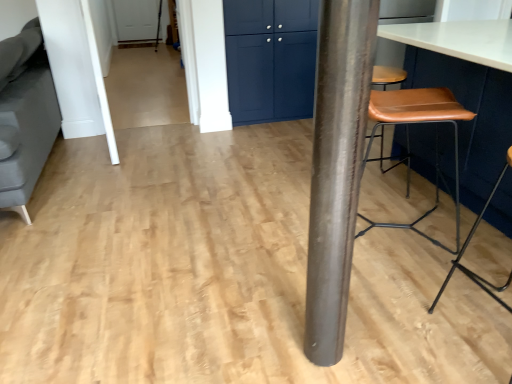
Image resolution: width=512 pixels, height=384 pixels. What do you see at coordinates (336, 168) in the screenshot?
I see `shiny metallic pole at center` at bounding box center [336, 168].

The width and height of the screenshot is (512, 384). Describe the element at coordinates (270, 59) in the screenshot. I see `matte blue cabinet at upper center` at that location.

The width and height of the screenshot is (512, 384). Describe the element at coordinates (100, 84) in the screenshot. I see `white smooth door at upper left` at that location.

Where is `brown leather stool at right`? brown leather stool at right is located at coordinates (467, 246).

You are a GUI agent. You are given a task and a screenshot of the screen. Output one action in this format:
    pyautogui.click(x=<x>, y=<y>)
    Task: Click on the brown leather stool at right
    The height and width of the screenshot is (384, 512).
    Given the screenshot: What is the action you would take?
    pyautogui.click(x=467, y=90)

Locate an element on the screen. The width and height of the screenshot is (512, 384). shiny metallic pole at center is located at coordinates [x=336, y=168].

Which is more to the left, gray fabric swivel chair at left or white smooth door at upper left?

gray fabric swivel chair at left.

From their relative heights in the image, would you say gray fabric swivel chair at left is taller or shorter than white smooth door at upper left?

gray fabric swivel chair at left is shorter than white smooth door at upper left.

Considering the relative sizes of gray fabric swivel chair at left and white smooth door at upper left in the image provided, is gray fabric swivel chair at left bigger than white smooth door at upper left?

Indeed, gray fabric swivel chair at left has a larger size compared to white smooth door at upper left.

Where is `beam behind the gray fabric swivel chair at left`? This screenshot has height=384, width=512. beam behind the gray fabric swivel chair at left is located at coordinates (100, 84).

The width and height of the screenshot is (512, 384). I want to click on chair that appears below the matte blue cabinet at upper center (from the image's perspective), so click(467, 246).

Looking at this image, between brown leather stool at right and matte blue cabinet at upper center, which one is positioned in front?

brown leather stool at right is more forward.

Is brown leather stool at right inside or outside of matte blue cabinet at upper center?

brown leather stool at right exists outside the volume of matte blue cabinet at upper center.

From the image's perspective, is brown leather stool at right below brown leather stool at right?

No, from the image's perspective, brown leather stool at right is not below brown leather stool at right.

Who is taller, brown leather stool at right or brown leather stool at right?

brown leather stool at right is taller.

Is brown leather stool at right next to brown leather stool at right and touching it?

No, brown leather stool at right is not in contact with brown leather stool at right.

From the image's perspective, between white smooth door at upper left and brown leather stool at right, which one is located above?

white smooth door at upper left appears higher in the image.

Would you say white smooth door at upper left is inside or outside brown leather stool at right?

white smooth door at upper left cannot be found inside brown leather stool at right.

From a real-world perspective, is white smooth door at upper left physically below brown leather stool at right?

Actually, white smooth door at upper left is physically above brown leather stool at right in the real world.

Does brown leather stool at right have a lesser height compared to white smooth door at upper left?

Yes.

From the image's perspective, would you say brown leather stool at right is positioned over white smooth door at upper left?

No, from the image's perspective, brown leather stool at right is not on top of white smooth door at upper left.

Where is `table that is under the white smooth door at upper left (from a real-world perspective)`? The width and height of the screenshot is (512, 384). table that is under the white smooth door at upper left (from a real-world perspective) is located at coordinates (467, 90).

Which is in front, point (467, 78) or point (113, 145)?

The point (467, 78) is more forward.

Considering their positions, is gray fabric swivel chair at left located in front of or behind brown leather stool at right?

Clearly, gray fabric swivel chair at left is behind brown leather stool at right.

Considering the points (32, 28) and (478, 279), which point is behind, point (32, 28) or point (478, 279)?

The point (32, 28) is more distant.

Looking at this image, considering the sizes of gray fabric swivel chair at left and brown leather stool at right in the image, is gray fabric swivel chair at left taller or shorter than brown leather stool at right?

Clearly, gray fabric swivel chair at left is taller compared to brown leather stool at right.

How much distance is there between gray fabric swivel chair at left and brown leather stool at right?

gray fabric swivel chair at left and brown leather stool at right are 8.36 feet apart from each other.

Do you think brown leather stool at right is within shiny metallic pole at center, or outside of it?

brown leather stool at right is not enclosed by shiny metallic pole at center.

Is brown leather stool at right facing away from shiny metallic pole at center?

No, shiny metallic pole at center is not at the back of brown leather stool at right.

From the picture: Who is smaller, brown leather stool at right or shiny metallic pole at center?

shiny metallic pole at center is smaller.

Is brown leather stool at right taller than shiny metallic pole at center?

Incorrect, the height of brown leather stool at right is not larger of that of shiny metallic pole at center.

The height and width of the screenshot is (384, 512). I want to click on swivel chair that appears in front of the white smooth door at upper left, so click(x=25, y=116).

What are the coordinates of `chair that appears below the matte blue cabinet at upper center (from a real-world perspective)` in the screenshot? It's located at (467, 246).

Estimate the real-world distances between objects in this image. Which object is closer to shiny metallic pole at center, gray fabric swivel chair at left or brown leather stool at right?

brown leather stool at right lies closer to shiny metallic pole at center than the other object.

Based on their spatial positions, is shiny metallic pole at center or matte blue cabinet at upper center further from white smooth door at upper left?

shiny metallic pole at center is further to white smooth door at upper left.

When comparing their distances from brown leather stool at right, does white smooth door at upper left or shiny metallic pole at center seem closer?

Based on the image, shiny metallic pole at center appears to be nearer to brown leather stool at right.

Considering their positions, is brown leather stool at right positioned further to shiny metallic pole at center than brown leather stool at right?

brown leather stool at right lies further to shiny metallic pole at center than the other object.

From the image, which object appears to be farther from gray fabric swivel chair at left, matte blue cabinet at upper center or shiny metallic pole at center?

shiny metallic pole at center.

From the image, which object appears to be nearer to shiny metallic pole at center, white smooth door at upper left or brown leather stool at right?

brown leather stool at right is closer to shiny metallic pole at center.

When comparing their distances from brown leather stool at right, does gray fabric swivel chair at left or matte blue cabinet at upper center seem closer?

Among the two, matte blue cabinet at upper center is located nearer to brown leather stool at right.

Based on their spatial positions, is gray fabric swivel chair at left or shiny metallic pole at center further from brown leather stool at right?

The object further to brown leather stool at right is gray fabric swivel chair at left.

Locate an element on the screen. The height and width of the screenshot is (384, 512). chair between shiny metallic pole at center and matte blue cabinet at upper center from front to back is located at coordinates (467, 246).

Find the location of a particular element. Image resolution: width=512 pixels, height=384 pixels. swivel chair between shiny metallic pole at center and matte blue cabinet at upper center in the front-back direction is located at coordinates (25, 116).

You are a GUI agent. You are given a task and a screenshot of the screen. Output one action in this format:
    pyautogui.click(x=<x>, y=<y>)
    Task: Click on the cabinetry located between gray fabric swivel chair at left and brown leather stool at right in the left-right direction
    
    Given the screenshot: What is the action you would take?
    pyautogui.click(x=270, y=59)

Find the location of a particular element. pillar between gray fabric swivel chair at left and brown leather stool at right from left to right is located at coordinates (336, 168).